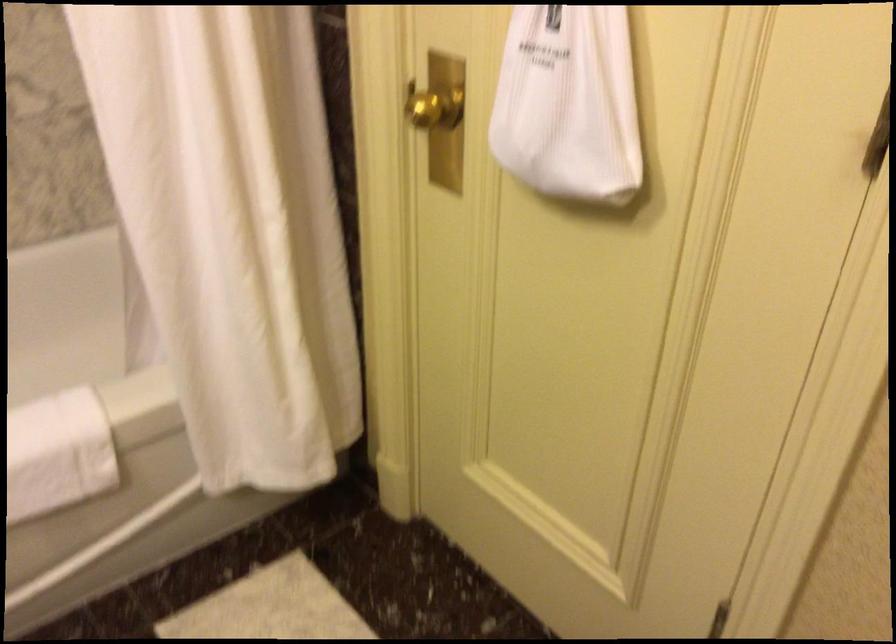
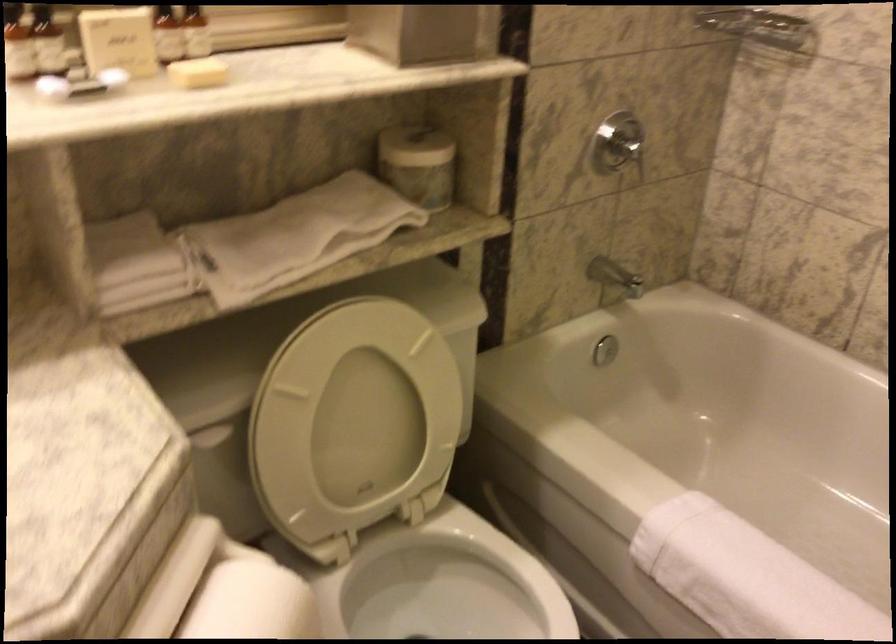
The images are taken continuously from a first-person perspective. In which direction is your viewpoint rotating?

The rotation direction of the camera is left-down.